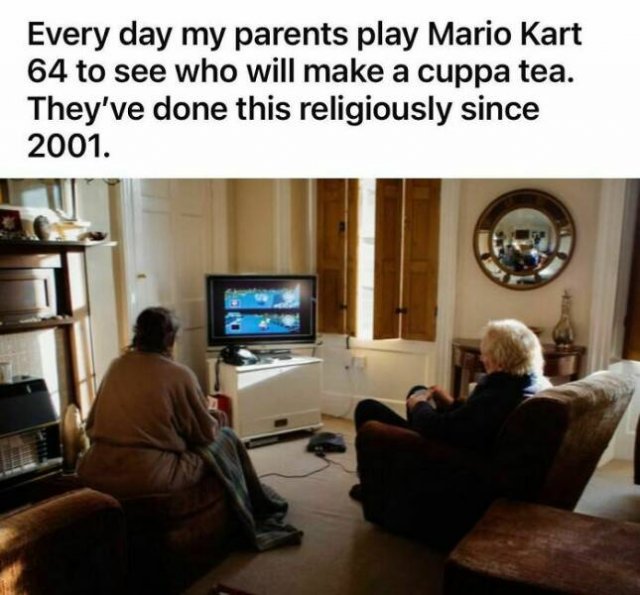
Find the location of a particular element. This screenshot has height=595, width=640. television is located at coordinates (266, 314).